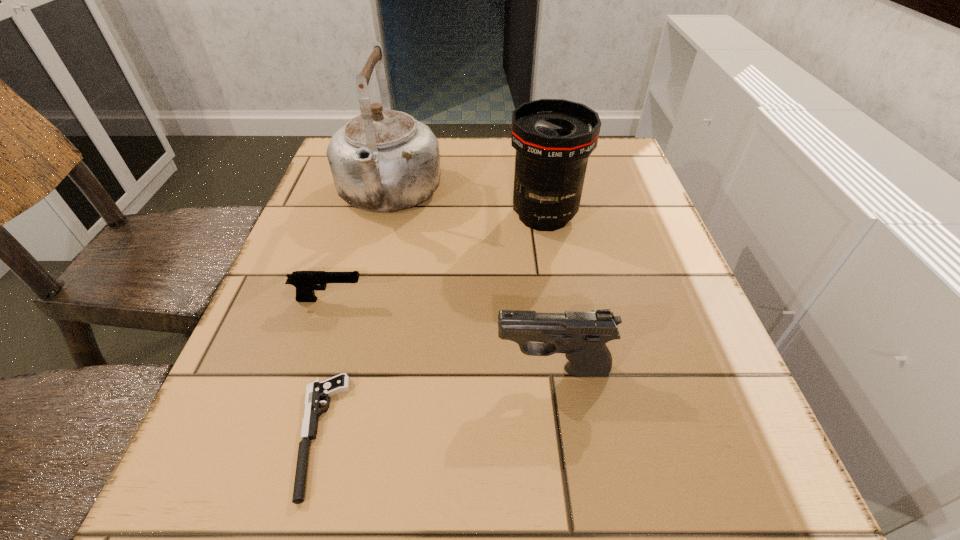
The width and height of the screenshot is (960, 540). I want to click on the tallest object, so [x=383, y=160].

The image size is (960, 540). I want to click on the second tallest object, so click(x=553, y=138).

Locate an element on the screen. the third shortest object is located at coordinates (581, 335).

At what (x,y) coordinates should I click in order to perform the action: click on the rightmost pistol. Please return your answer as a coordinate pair (x, y). The height and width of the screenshot is (540, 960). Looking at the image, I should click on coord(581,335).

I want to click on the farthest pistol, so click(305, 282).

This screenshot has width=960, height=540. What are the coordinates of `the third farthest object` in the screenshot? It's located at (305, 282).

At what (x,y) coordinates should I click in order to perform the action: click on the shortest pistol. Please return your answer as a coordinate pair (x, y). The height and width of the screenshot is (540, 960). Looking at the image, I should click on (317, 390).

Locate an element on the screen. free spot located 0.390m at the spout of the tallest object is located at coordinates (333, 412).

Identify the location of vacant region located 0.330m on the left of the fourth shortest object. (356, 215).

Where is `free spot located at the barrel of the rightmost pistol`? free spot located at the barrel of the rightmost pistol is located at coordinates (272, 370).